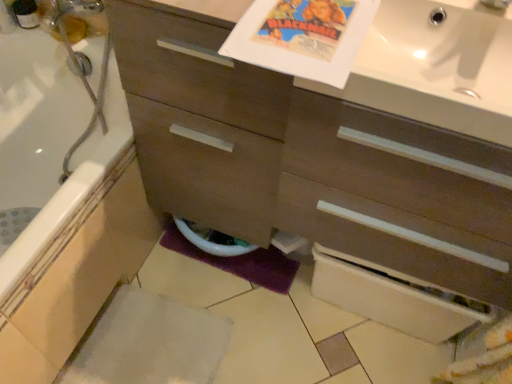
Question: Considering the positions of white glossy sink at upper right and white glossy toilet bowl at lower center in the image, is white glossy sink at upper right bigger or smaller than white glossy toilet bowl at lower center?

Choices:
 (A) small
 (B) big

Answer: (B)

Question: Is white glossy sink at upper right in front of or behind white glossy toilet bowl at lower center in the image?

Choices:
 (A) front
 (B) behind

Answer: (A)

Question: Which object is the closest to the white glossy bathtub at lower left?

Choices:
 (A) matte brown cabinet at center
 (B) white glossy toilet bowl at lower center
 (C) white glossy sink at upper right

Answer: (B)

Question: Which of these objects is positioned closest to the matte brown cabinet at center?

Choices:
 (A) white glossy bathtub at lower left
 (B) white glossy toilet bowl at lower center
 (C) white glossy sink at upper right

Answer: (C)